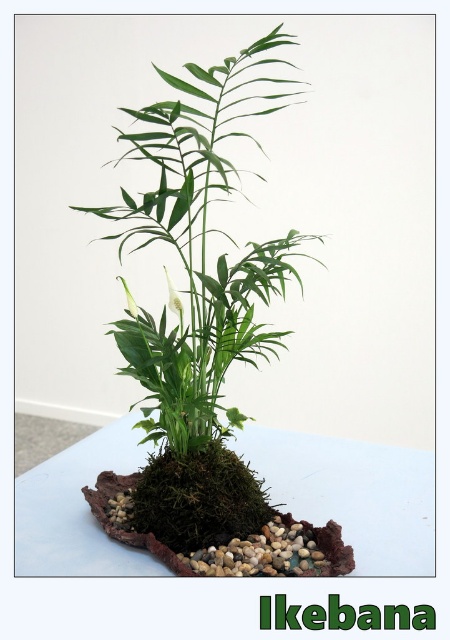
Can you confirm if white matte flower at center is positioned above white glossy flower at center?

Yes, white matte flower at center is above white glossy flower at center.

Is point (162, 266) positioned in front of point (125, 285)?

No.

Locate an element on the screen. The width and height of the screenshot is (450, 640). white matte flower at center is located at coordinates (172, 296).

Does green mossy plant at center appear on the left side of white matte table at center?

Correct, you'll find green mossy plant at center to the left of white matte table at center.

Can you confirm if green mossy plant at center is shorter than white matte table at center?

No.

What do you see at coordinates (201, 300) in the screenshot?
I see `green mossy plant at center` at bounding box center [201, 300].

The width and height of the screenshot is (450, 640). Identify the location of green mossy plant at center. (201, 300).

Looking at this image, who is more forward, (208, 534) or (136, 307)?

Point (208, 534)

Between point (130, 140) and point (116, 276), which one is positioned behind?

The point (116, 276) is behind.

Find the location of a particular element. Image resolution: width=450 pixels, height=640 pixels. green mossy plant at center is located at coordinates (201, 300).